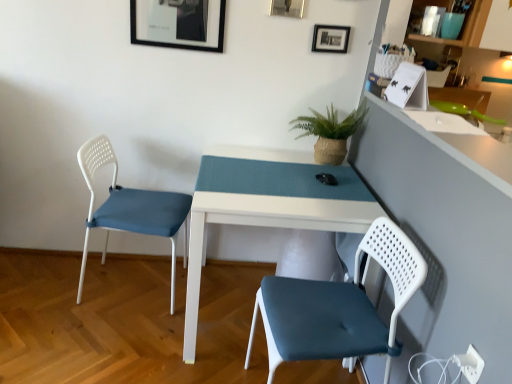
Where is `free space underneath white matte table at center (from a real-world perspective)`? Image resolution: width=512 pixels, height=384 pixels. free space underneath white matte table at center (from a real-world perspective) is located at coordinates (223, 305).